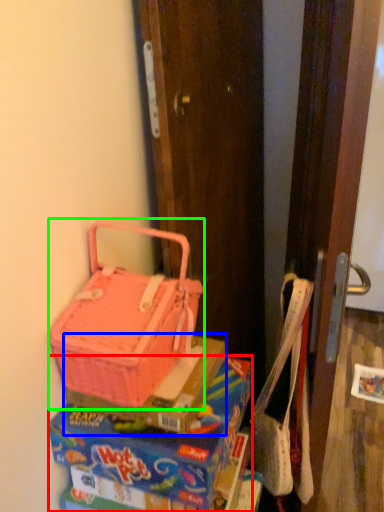
Question: Based on their relative distances, which object is nearer to lunch box (highlighted by a red box)? Choose from box (highlighted by a blue box) and picnic basket (highlighted by a green box).

Choices:
 (A) box
 (B) picnic basket

Answer: (A)